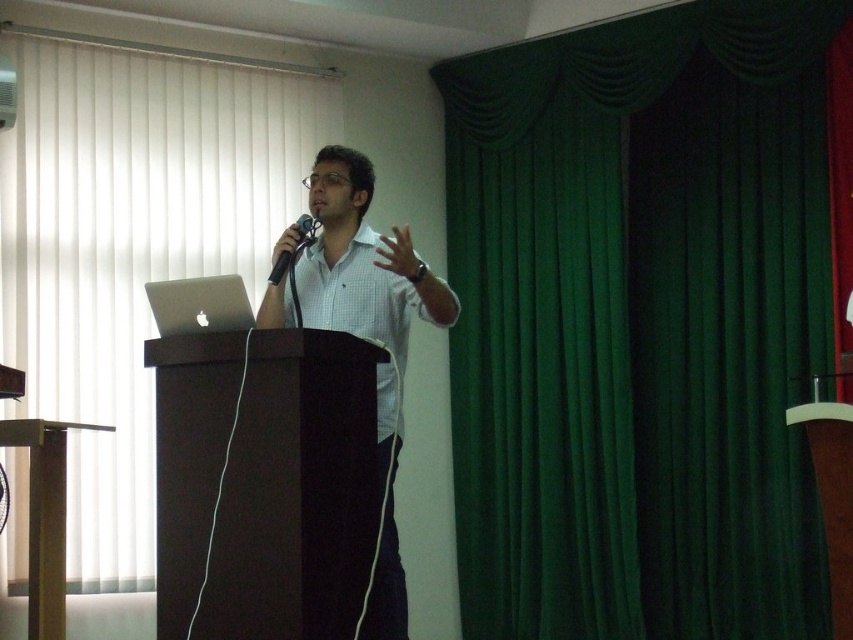
Can you confirm if green velvet curtain at right is bigger than green fabric curtain at upper right?

Yes.

How distant is green velvet curtain at right from green fabric curtain at upper right?

green velvet curtain at right is 1.93 meters from green fabric curtain at upper right.

Between point (524, 349) and point (131, 266), which one is positioned in front?

Point (131, 266) is more forward.

You are a GUI agent. You are given a task and a screenshot of the screen. Output one action in this format:
    pyautogui.click(x=<x>, y=<y>)
    Task: Click on the green velvet curtain at right
    The image size is (853, 640).
    Given the screenshot: What is the action you would take?
    pyautogui.click(x=601, y=340)

Does point (70, 150) lie in front of point (401, 349)?

That is False.

Can you confirm if green fabric curtain at upper right is thinner than white checkered shirt at center?

Incorrect, green fabric curtain at upper right's width is not less than white checkered shirt at center's.

Is point (201, 147) less distant than point (402, 230)?

No, (201, 147) is further to viewer.

You are a GUI agent. You are given a task and a screenshot of the screen. Output one action in this format:
    pyautogui.click(x=<x>, y=<y>)
    Task: Click on the green fabric curtain at upper right
    The height and width of the screenshot is (640, 853).
    Given the screenshot: What is the action you would take?
    pyautogui.click(x=132, y=248)

Is point (744, 65) positioned after point (363, 163)?

Yes, point (744, 65) is behind point (363, 163).

Is green velvet curtain at right bigger than white checkered shirt at center?

Correct, green velvet curtain at right is larger in size than white checkered shirt at center.

Describe the element at coordinates (601, 340) in the screenshot. This screenshot has width=853, height=640. I see `green velvet curtain at right` at that location.

Where is `green velvet curtain at right`? green velvet curtain at right is located at coordinates (601, 340).